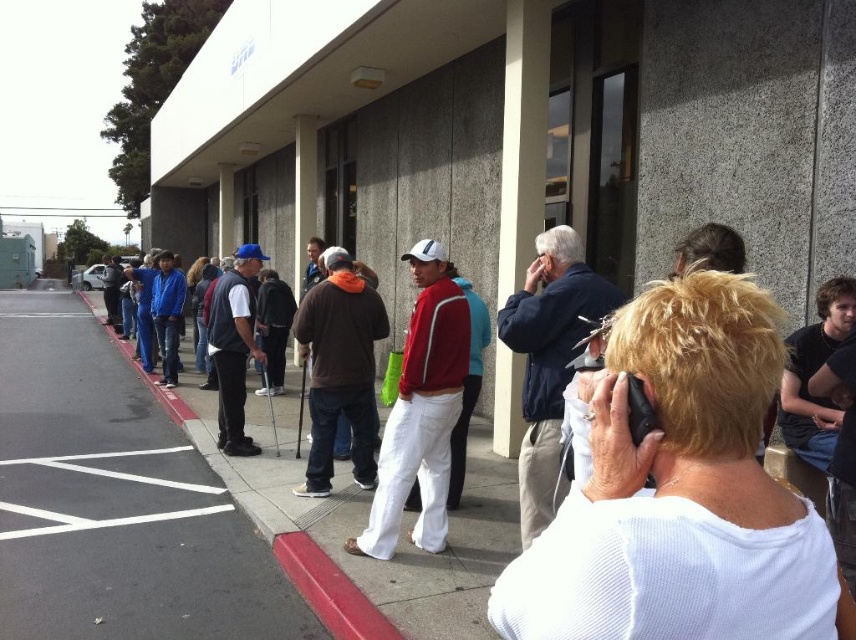
Question: In this image, where is white cotton shirt at center located relative to white asphalt at lower left?

Choices:
 (A) below
 (B) above

Answer: (B)

Question: Which of the following is the closest to the observer?

Choices:
 (A) (158, 449)
 (B) (244, 403)

Answer: (B)

Question: Observing the image, what is the correct spatial positioning of brown soft sweater at center in reference to white asphalt parking line at lower left?

Choices:
 (A) left
 (B) right

Answer: (B)

Question: Is dark blue jacket at center smaller than red rubber curb at lower center?

Choices:
 (A) no
 (B) yes

Answer: (A)

Question: Which of these objects is positioned closest to the white cotton shirt at center?

Choices:
 (A) gray asphalt at left
 (B) blue fabric baseball cap at center
 (C) red rubber curb at lower center

Answer: (A)

Question: Which point is farther to the camera?

Choices:
 (A) (254, 348)
 (B) (205, 429)
 (C) (74, 467)
 (D) (544, 236)

Answer: (B)